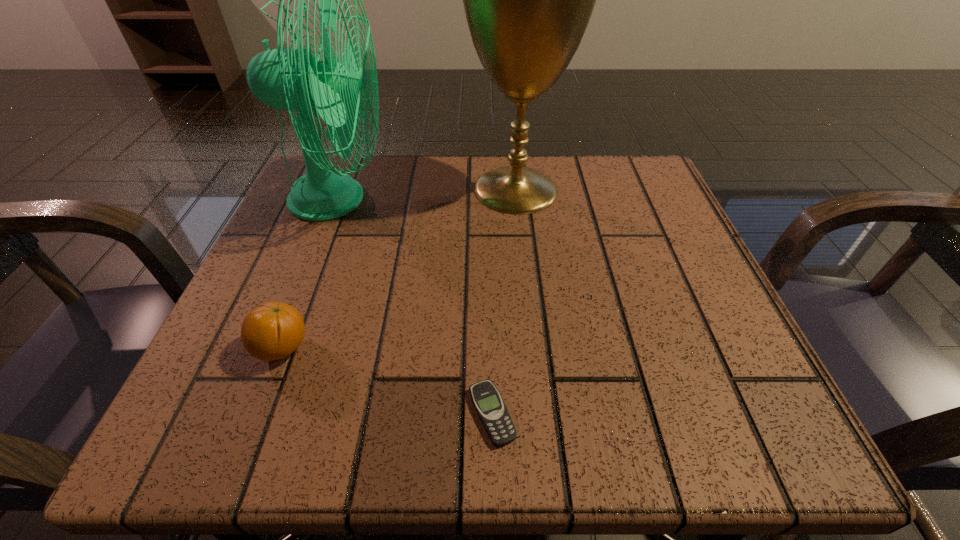
The height and width of the screenshot is (540, 960). I want to click on vacant region that satisfies the following two spatial constraints: 1. in front of the orange to blow air; 2. on the right side of the fan, so click(279, 348).